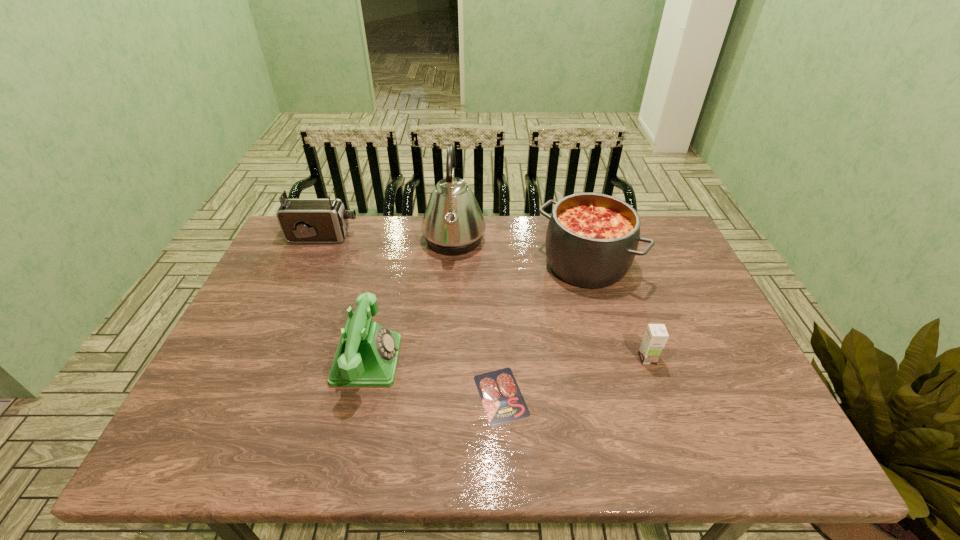
What are the coordinates of `vacant space located 0.180m on the right of the fifth tallest object` in the screenshot? It's located at (728, 359).

I want to click on free spot located on the back of the shortest object, so click(x=499, y=342).

Locate an element on the screen. kettle located in the far edge section of the desktop is located at coordinates (453, 224).

Identify the location of casserole present at the far edge. The image size is (960, 540). (591, 241).

Where is `camcorder located at the far edge`? The width and height of the screenshot is (960, 540). camcorder located at the far edge is located at coordinates (301, 220).

At what (x,y) coordinates should I click in order to perform the action: click on object that is at the near edge. Please return your answer as a coordinate pair (x, y). Looking at the image, I should click on click(x=503, y=402).

This screenshot has height=540, width=960. What are the coordinates of `object that is positioned at the left edge` in the screenshot? It's located at (301, 220).

You are a GUI agent. You are given a task and a screenshot of the screen. Output one action in this format:
    pyautogui.click(x=<x>, y=<y>)
    Task: Click on the object that is at the far left corner
    The image size is (960, 540).
    Given the screenshot: What is the action you would take?
    pyautogui.click(x=301, y=220)

Image resolution: width=960 pixels, height=540 pixels. I want to click on free space at the far edge of the desktop, so click(x=493, y=244).

This screenshot has height=540, width=960. What are the coordinates of `free space at the near edge of the desktop` in the screenshot? It's located at (510, 435).